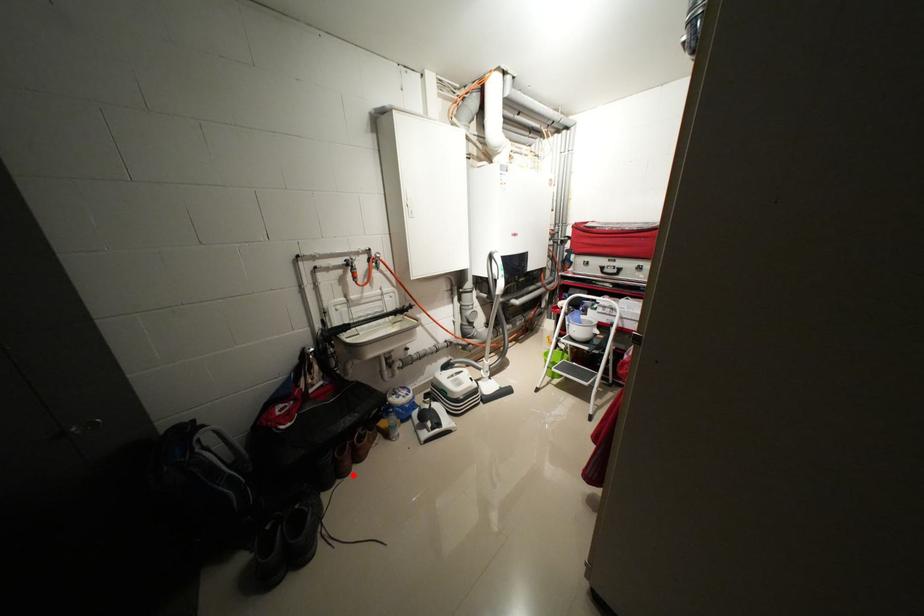
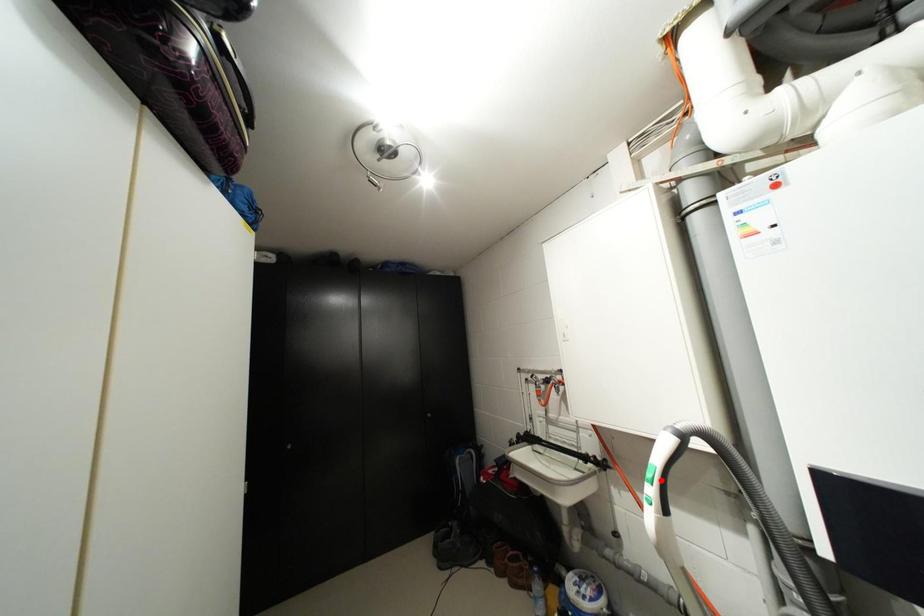
I am providing you with two images of the same scene from different viewpoints. A red point is marked on the first image and another point is marked on the second image. Do the highlighted points in image1 and image2 indicate the same real-world spot?

No